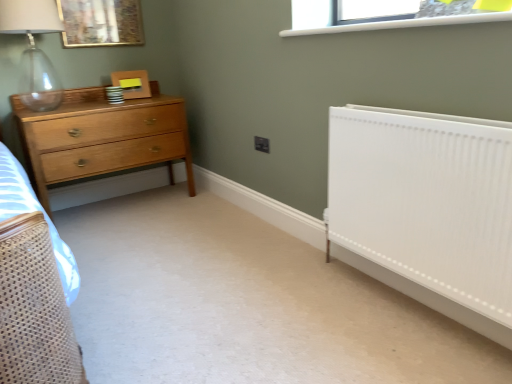
The image size is (512, 384). Identify the location of free space that is in between light brown wood chest of drawers at left and white smooth radiator at right. (232, 252).